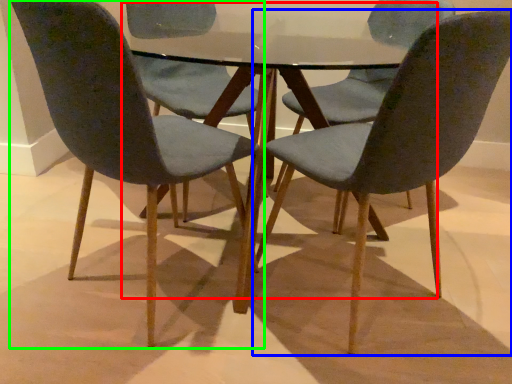
Question: Estimate the real-world distances between objects in this image. Which object is farther from round table (highlighted by a red box), chair (highlighted by a blue box) or chair (highlighted by a green box)?

Choices:
 (A) chair
 (B) chair

Answer: (B)